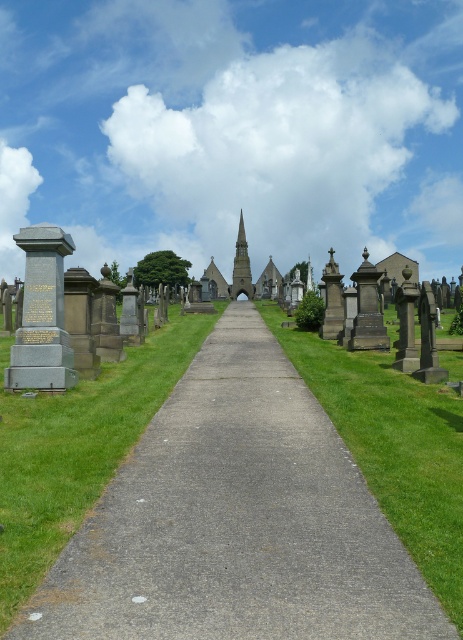
You are standing at the entrance of the cemetery and see the gray concrete pavement at center. Based on its position, can you estimate how far it is from the entrance?

The gray concrete pavement at center is located at point (236,522), so it is approximately 81.6 centimeters away from the entrance along the horizontal axis and 51.0 centimeters along the vertical axis.

You are standing at the entrance of the cemetery and want to know which object is taller between the gray concrete pavement at center and the smooth gray spire at center. Based on the scene description, which one is taller?

The smooth gray spire at center is taller than the gray concrete pavement at center.